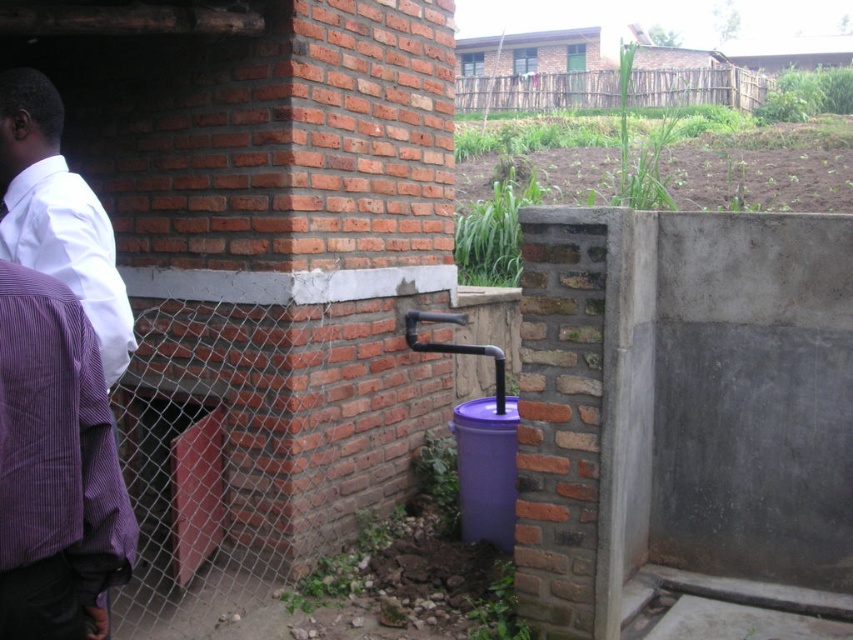
Can you confirm if purple striped robe at left is positioned above wooden fence at upper center?

Incorrect, purple striped robe at left is not positioned above wooden fence at upper center.

From the picture: Who is more distant from viewer, [51,369] or [479,76]?

The point [479,76] is behind.

The width and height of the screenshot is (853, 640). In order to click on purple striped robe at left in this screenshot , I will do `click(55, 467)`.

This screenshot has width=853, height=640. Identify the location of purple striped robe at left. (55, 467).

Can you confirm if purple striped robe at left is smaller than white shirt at left?

Yes, purple striped robe at left is smaller than white shirt at left.

Consider the image. Is purple striped robe at left further to camera compared to white shirt at left?

No, purple striped robe at left is in front of white shirt at left.

Identify the location of purple striped robe at left. This screenshot has width=853, height=640. (55, 467).

Identify the location of purple striped robe at left. This screenshot has height=640, width=853. (55, 467).

Who is lower down, white shirt at left or wooden fence at upper center?

white shirt at left is lower down.

Based on the photo, between white shirt at left and wooden fence at upper center, which one appears on the right side from the viewer's perspective?

wooden fence at upper center is more to the right.

At what (x,y) coordinates should I click in order to perform the action: click on white shirt at left. Please return your answer as a coordinate pair (x, y). Looking at the image, I should click on (57, 212).

Where is `white shirt at left`? white shirt at left is located at coordinates (57, 212).